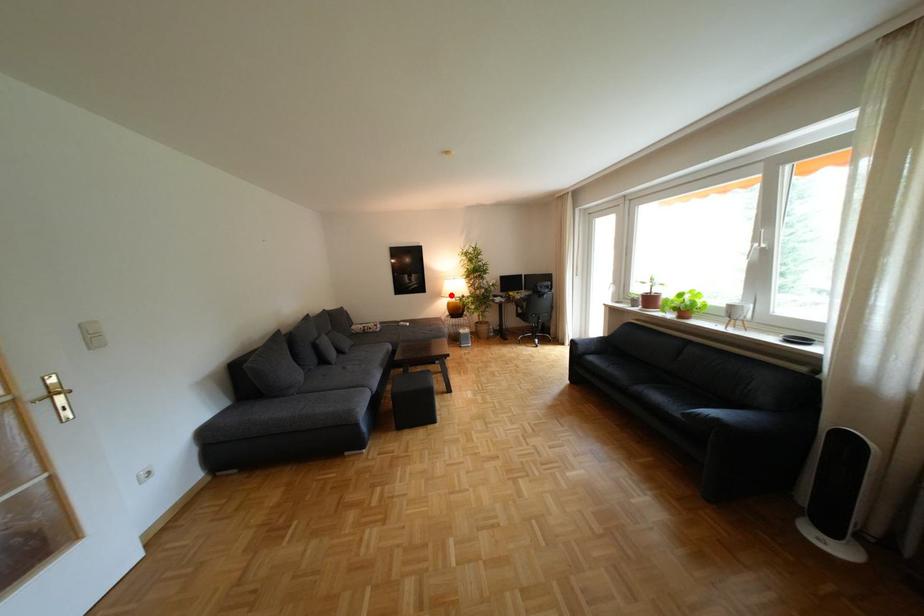
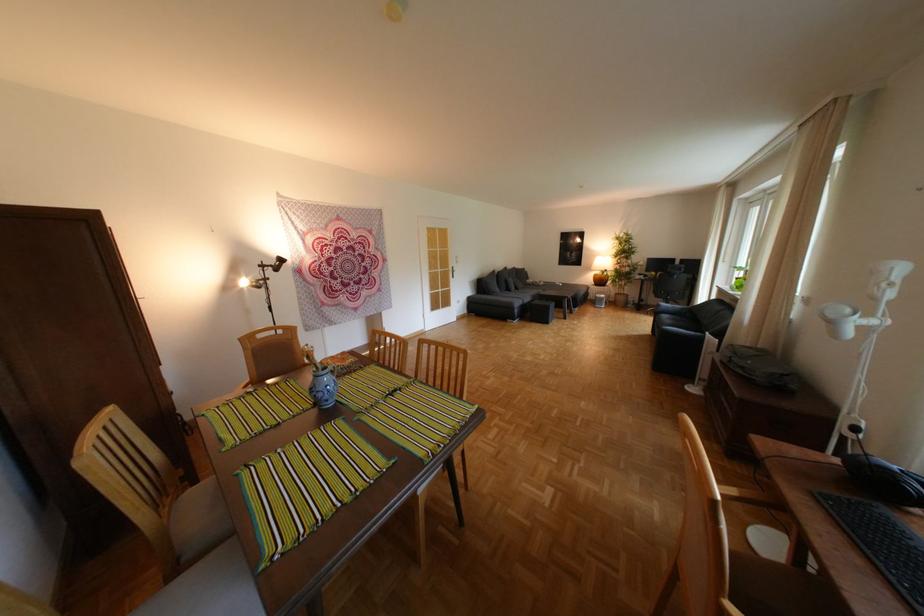
Question: I am providing you with two images of the same scene from different viewpoints. Given a red point in image1, look at the same physical point in image2. Is it:

Choices:
 (A) Closer to the viewpoint
 (B) Farther from the viewpoint

Answer: (A)